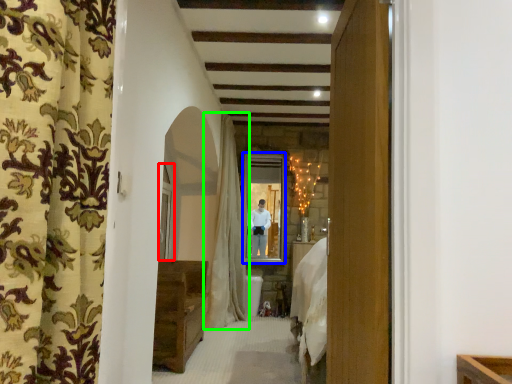
Question: Which object is positioned closest to window (highlighted by a red box)? Select from window (highlighted by a blue box) and curtain (highlighted by a green box).

Choices:
 (A) window
 (B) curtain

Answer: (B)